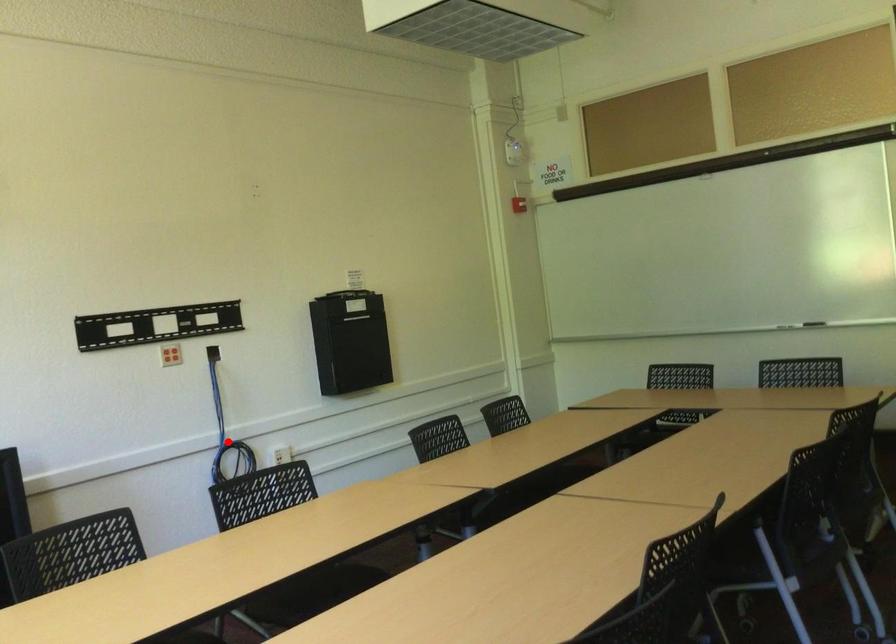
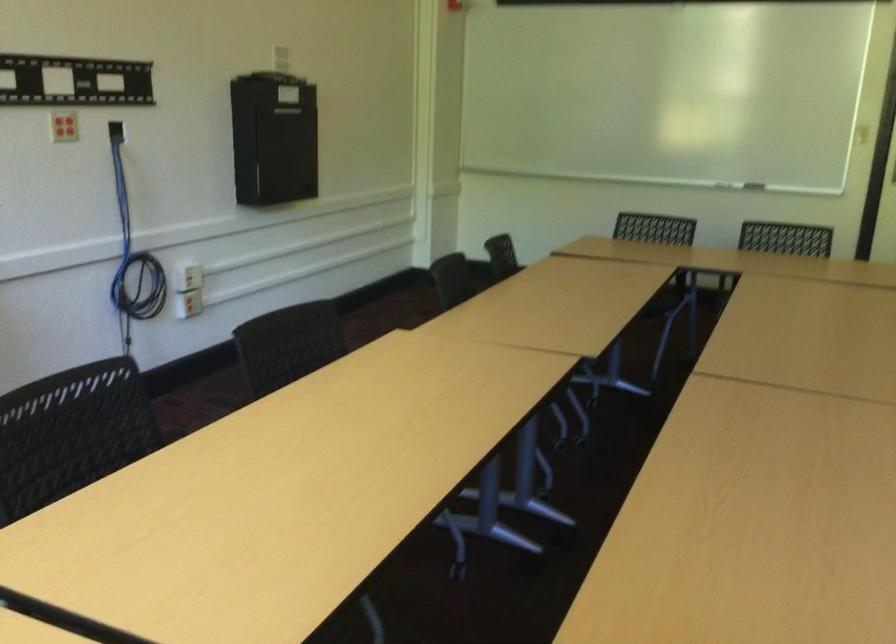
Question: I am providing you with two images of the same scene from different viewpoints. Image1 has a red point marked. In image2, the corresponding 3D location appears at what relative position? Reply with the corresponding letter.

Choices:
 (A) Closer
 (B) Farther

Answer: (A)